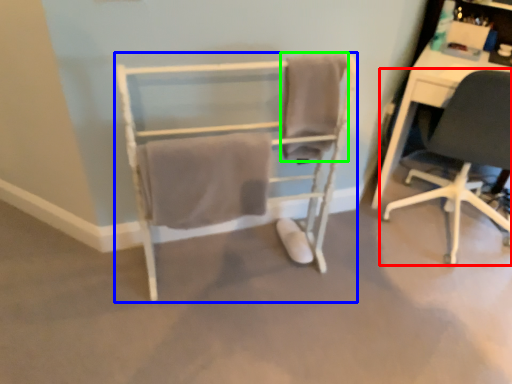
Question: Which object is positioned farthest from chair (highlighted by a red box)? Select from chair (highlighted by a blue box) and bath towel (highlighted by a green box).

Choices:
 (A) chair
 (B) bath towel

Answer: (A)